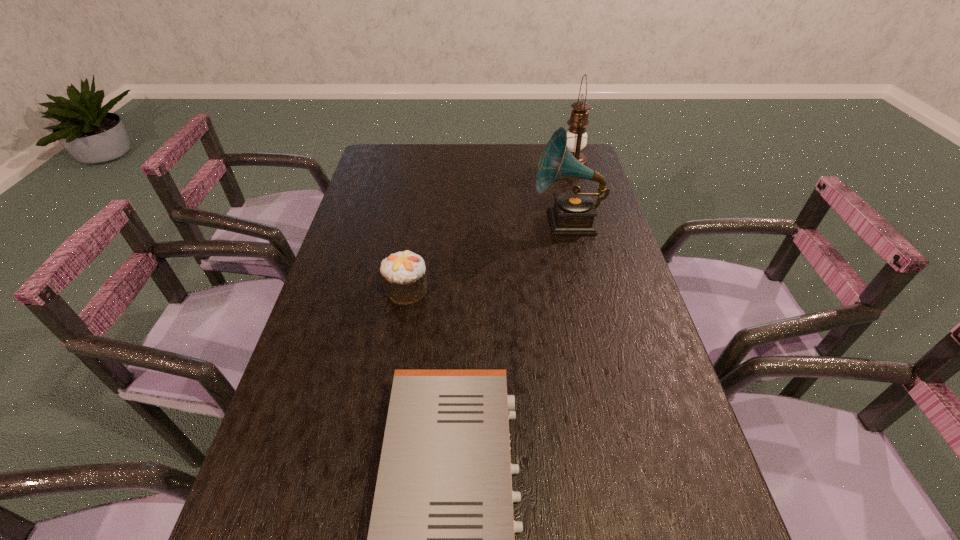
This screenshot has width=960, height=540. I want to click on vacant space that's between the phonograph_record and the second nearest object, so click(487, 256).

This screenshot has width=960, height=540. I want to click on vacant region between the second shortest object and the farthest object, so click(490, 228).

Choose which object is the third nearest neighbor to the farthest object. Please provide its 2D coordinates. Your answer should be formatted as a tuple, i.e. [(x, y)], where the tuple contains the x and y coordinates of a point satisfying the conditions above.

[(441, 539)]

The height and width of the screenshot is (540, 960). Identify the location of object identified as the second closest to the radio receiver. (573, 213).

The image size is (960, 540). What are the coordinates of `vacant space that satisfies the following two spatial constraints: 1. on the front side of the oil lamp; 2. from the horn of the third nearest object` in the screenshot? It's located at (588, 222).

You are a GUI agent. You are given a task and a screenshot of the screen. Output one action in this format:
    pyautogui.click(x=<x>, y=<y>)
    Task: Click on the blank area in the image that satisfies the following two spatial constraints: 1. on the back side of the oil lamp; 2. on the left side of the third tallest object
    This screenshot has height=540, width=960.
    Given the screenshot: What is the action you would take?
    pyautogui.click(x=427, y=166)